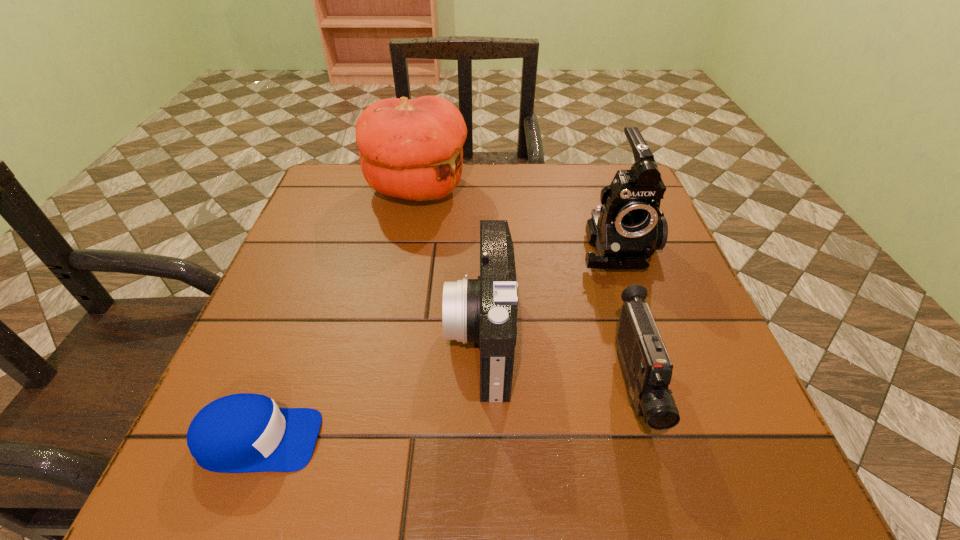
What are the coordinates of `the farthest object` in the screenshot? It's located at (412, 149).

This screenshot has height=540, width=960. Identify the location of the tallest camcorder. click(628, 228).

You are a GUI agent. You are given a task and a screenshot of the screen. Output one action in this format:
    pyautogui.click(x=<x>, y=<y>)
    Task: Click on the fourth nearest object
    The image size is (960, 540).
    Given the screenshot: What is the action you would take?
    pyautogui.click(x=628, y=228)

The image size is (960, 540). I want to click on the third tallest object, so click(x=484, y=310).

The height and width of the screenshot is (540, 960). Identify the location of the leftmost camcorder. [x=484, y=310].

You are a GUI agent. You are given a task and a screenshot of the screen. Output one action in this format:
    pyautogui.click(x=<x>, y=<y>)
    Task: Click on the shortest camcorder
    Image resolution: width=960 pixels, height=540 pixels.
    Given the screenshot: What is the action you would take?
    pyautogui.click(x=647, y=369)

Find the location of a particular element. This screenshot has height=540, width=960. baseball cap is located at coordinates (239, 433).

Image resolution: width=960 pixels, height=540 pixels. What are the coordinates of `vacant area situated on the front of the pumpkin` in the screenshot? It's located at (390, 331).

This screenshot has height=540, width=960. Find the location of `vacant space located on the lens mount of the second farthest object`. vacant space located on the lens mount of the second farthest object is located at coordinates (646, 333).

You are a GUI agent. You are given a task and a screenshot of the screen. Output one action in this format:
    pyautogui.click(x=<x>, y=<y>)
    Task: Click on the vacant space positioned 0.180m on the lens of the third tallest object
    
    Given the screenshot: What is the action you would take?
    pyautogui.click(x=347, y=336)